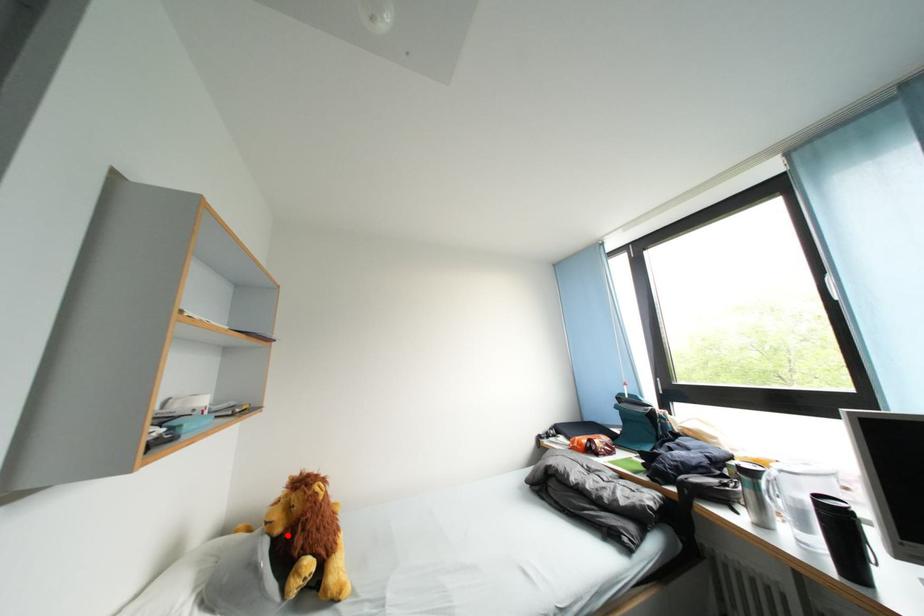
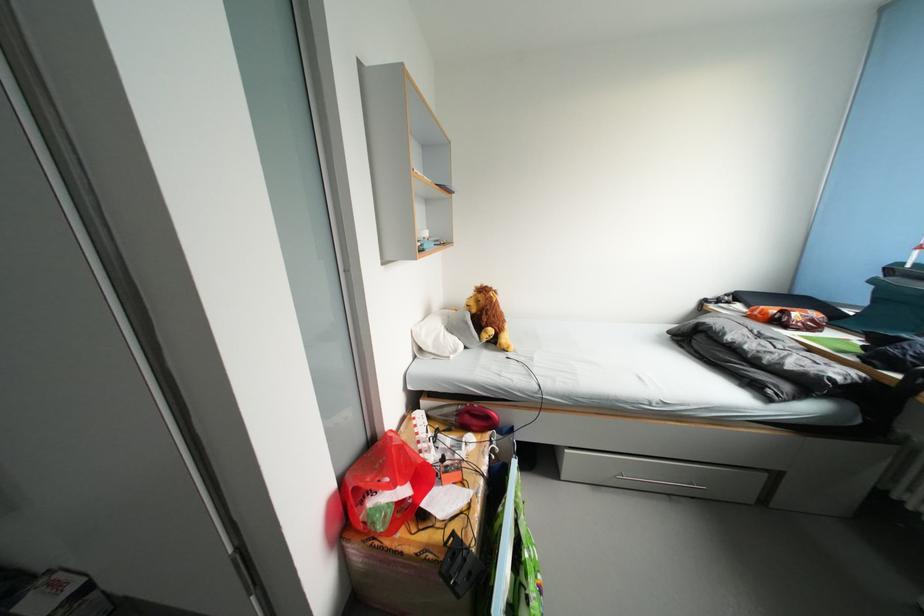
Find the pixel in the second image that matches the highlighted location in the first image.

(482, 315)